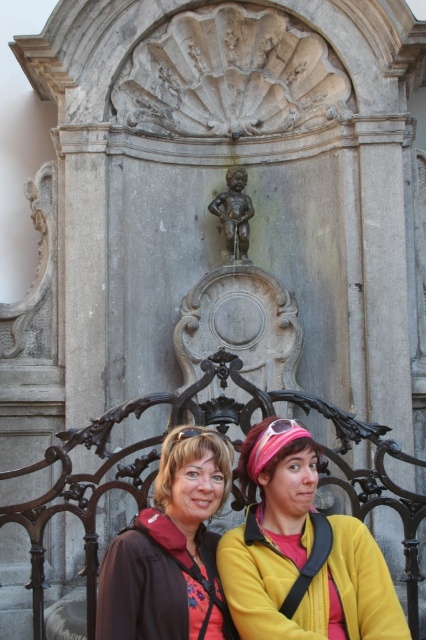
You are standing in front of the historical stone fountain with the benches. A treasure map says there is a hidden gem located at a point exactly 37.32 meters away from where you are standing. According to the image, is the point marked as point (187, 429) in the image the location of the hidden gem?

Yes, the point marked as point (187, 429) is exactly 37.32 meters away from the viewer, so it is the location of the hidden gem.

You are a tour guide explaining the historical fountain to a group. You notice a matte brown jacket at lower center and a bronze statue at center. How far apart are these two items from each other?

The matte brown jacket at lower center is 88.36 feet from the bronze statue at center.